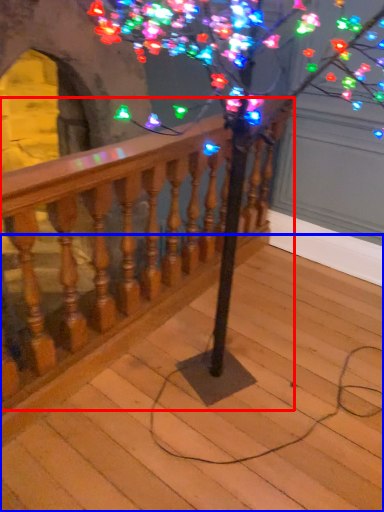
Question: Which object appears farthest to the camera in this image, rail (highlighted by a red box) or stairs (highlighted by a blue box)?

Choices:
 (A) rail
 (B) stairs

Answer: (A)